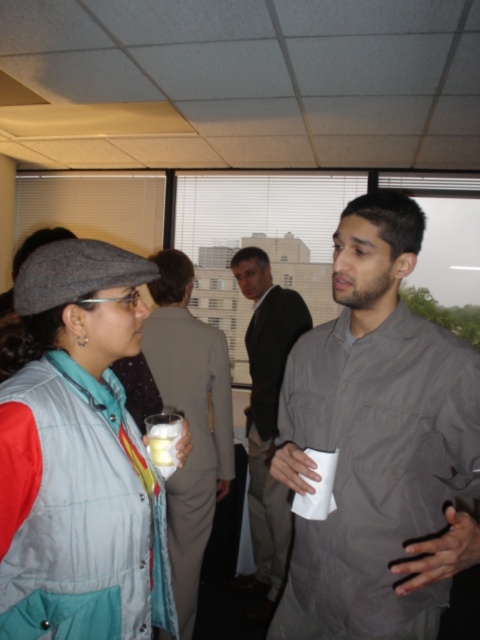
Question: Which object appears closest to the camera in this image?

Choices:
 (A) matte gray cap at left
 (B) matte gray suit at center
 (C) dark gray shirt at center

Answer: (A)

Question: Which object is closer to the camera taking this photo?

Choices:
 (A) gray matte shirt at right
 (B) matte gray cap at left
 (C) dark gray shirt at center

Answer: (B)

Question: Is matte gray suit at center bigger than dark gray shirt at center?

Choices:
 (A) no
 (B) yes

Answer: (A)

Question: Among these objects, which one is nearest to the camera?

Choices:
 (A) dark gray shirt at center
 (B) matte gray cap at left
 (C) gray matte shirt at right
 (D) matte gray suit at center

Answer: (B)

Question: Is gray matte shirt at right to the left of dark gray shirt at center from the viewer's perspective?

Choices:
 (A) yes
 (B) no

Answer: (B)

Question: Is gray matte shirt at right positioned before matte gray suit at center?

Choices:
 (A) yes
 (B) no

Answer: (A)